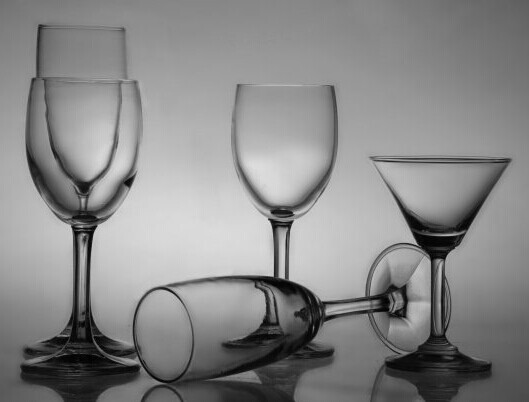
The height and width of the screenshot is (402, 529). Identify the location of glass stem. (354, 303), (282, 253), (434, 287), (83, 286), (82, 198).